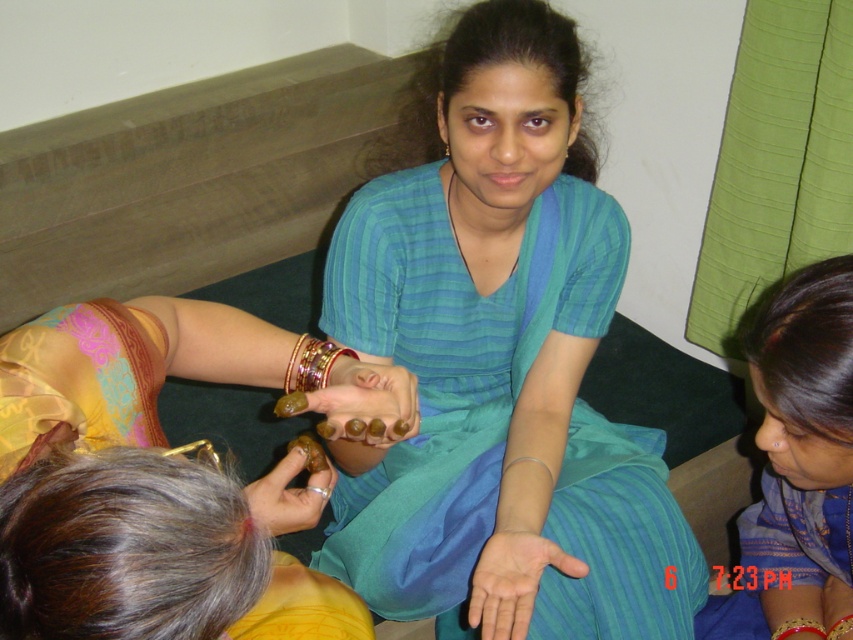
Question: Which point is closer to the camera taking this photo?

Choices:
 (A) (316, 385)
 (B) (509, 596)

Answer: (A)

Question: Based on their relative distances, which object is farther from the matte gold bangles at lower left?

Choices:
 (A) matte blue hand at center
 (B) matte gold ring at center
 (C) gold painted nails at center

Answer: (A)

Question: Is gold metallic bracelet at center thinner than silver metallic bracelet at lower center?

Choices:
 (A) no
 (B) yes

Answer: (B)

Question: Can you confirm if blue silk saree at center is smaller than gold woven bracelet at center?

Choices:
 (A) no
 (B) yes

Answer: (A)

Question: Which object is positioned closest to the gold metallic bracelet at center?

Choices:
 (A) blue satin dress at lower right
 (B) gold woven bracelet at center

Answer: (B)

Question: Can you confirm if matte blue hand at center is positioned to the left of gold woven bracelet at center?

Choices:
 (A) yes
 (B) no

Answer: (A)